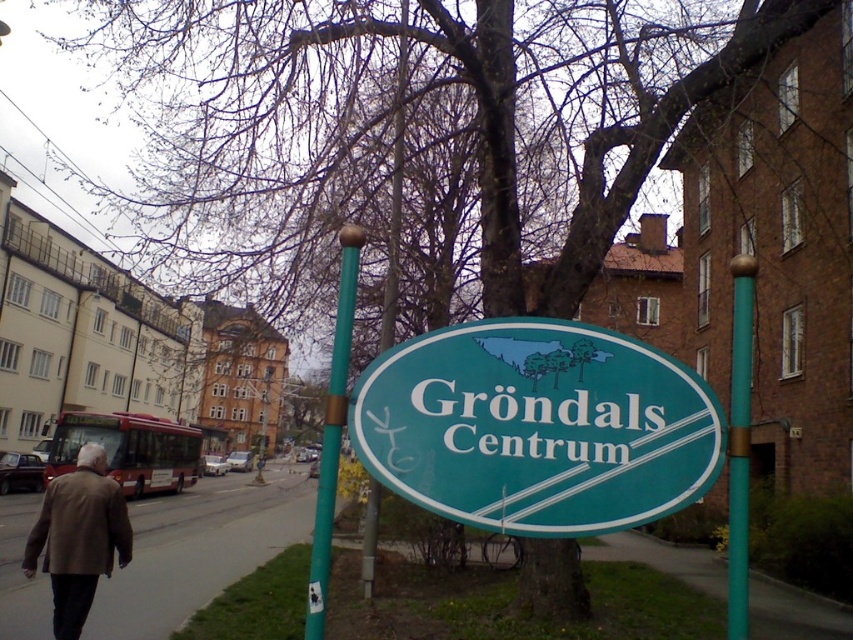
You are standing on the sidewalk in the Grondals Centrum area and see the gray asphalt at lower left and the brown leather jacket at lower left. Which object is closer to you?

The gray asphalt at lower left is closer to you since it is further to the viewer than the brown leather jacket at lower left.

You are a delivery person standing at the edge of the gray asphalt at lower left, and you need to place a package on the brown leather jacket at lower left. Can you reach it without moving from your current position?

The gray asphalt at lower left and brown leather jacket at lower left are 5.21 meters apart. Since the distance is more than an average person can reach, you cannot place the package without moving.

You are a delivery person with a 3.5 feet wide package. You need to pass through the space between the green plastic sign at center and the teal painted metal pole at center. Can your package fit through the space without bending it?

The distance between the green plastic sign at center and the teal painted metal pole at center is 3.73 feet. Since the package is 3.5 feet wide, it can fit through the space without bending.